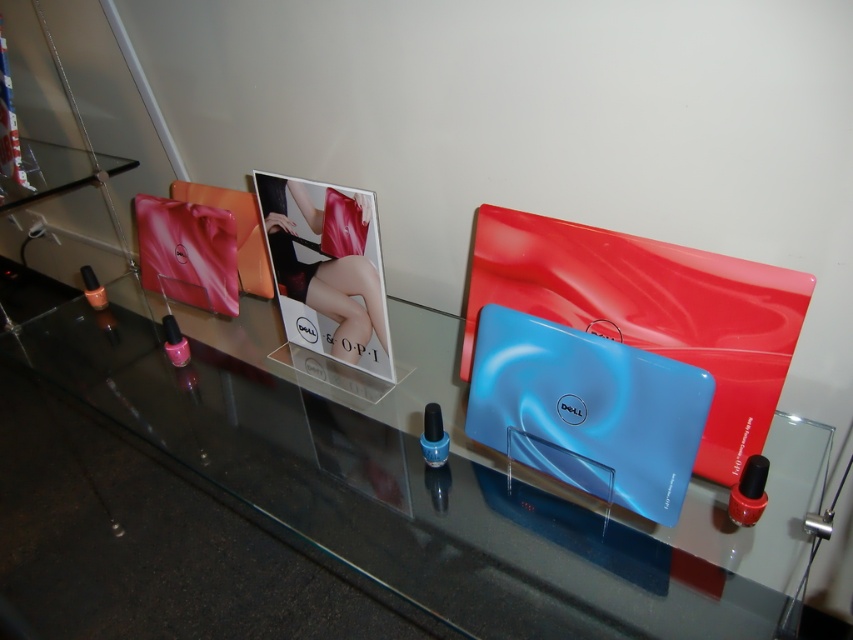
You are standing in front of the display setup. There are two points marked on the glass surface. One is at coordinate point (601,452) and the other at point (315,198). Which point is closer to you?

Point (601,452) is closer to the viewer than point (315,198).

You are standing in front of the display setup and want to place a new decorative item between the two points, point 1 at coordinates point (305, 474) and point 2 at coordinates point (558, 476). Based on their positions, which point is closer to you, point 1 or point 2?

Point 2 at coordinates point (558, 476) is closer to you because point 1 at coordinates point (305, 474) is behind it.